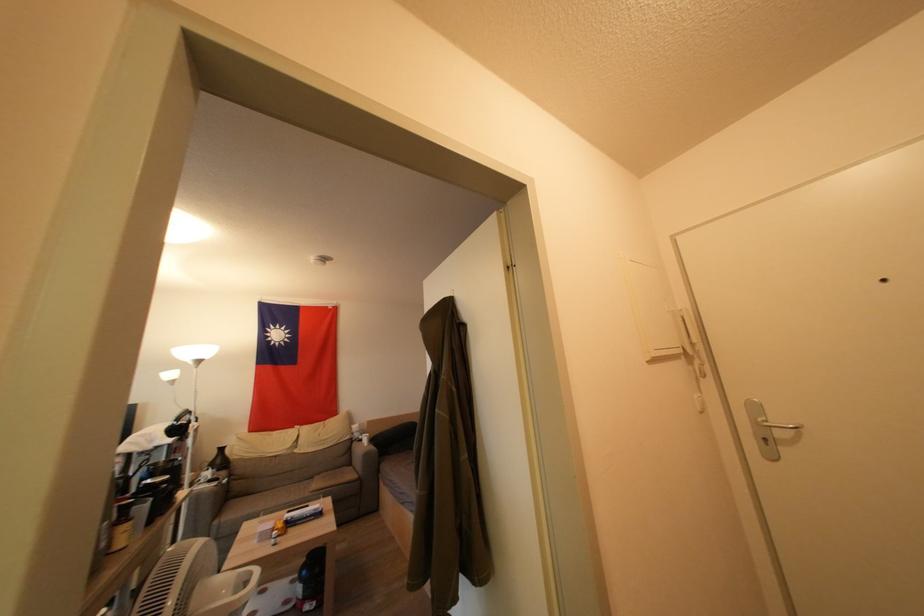
What do you see at coordinates (771, 424) in the screenshot? I see `the metal door handle` at bounding box center [771, 424].